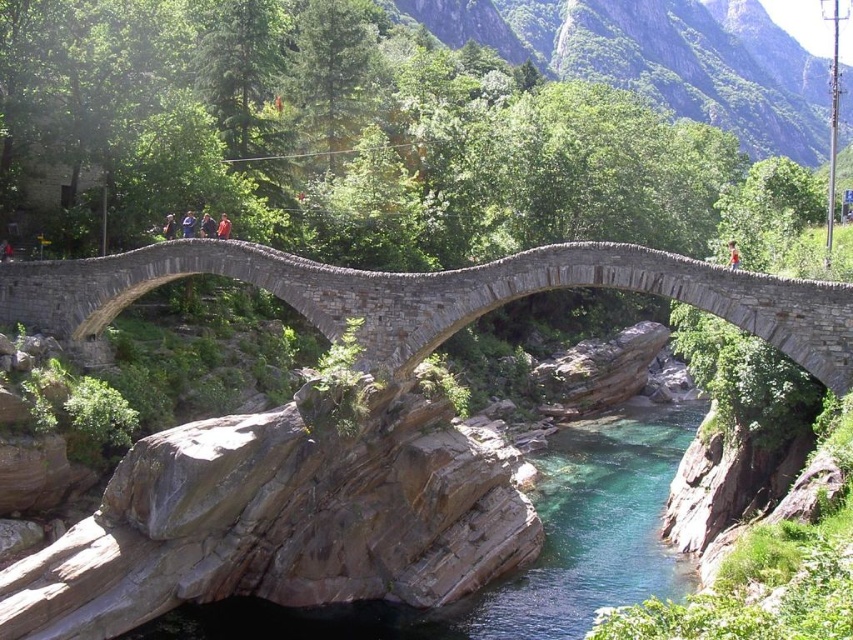
You are a hiker who has lost your jacket. You see the blue denim jacket at upper center and the dark blue fabric jacket at center in the image. Which jacket is closer to you?

The dark blue fabric jacket at center is closer to you since it is positioned lower in the image compared to the blue denim jacket at upper center, which is further away.

Looking at this image, you are standing on the stone bridge and looking down. You see the clear stone river at center and the orange fabric person at center. Which object is closer to you?

The clear stone river at center is closer to you because it is in front of the orange fabric person at center.

You are observing a scene where two people are standing on a stone bridge over a river. You notice a dark blue shirt at center and an orange fabric person at center. Which of the two has a wider torso?

The orange fabric person at center has a wider torso since the dark blue shirt at center is narrower.